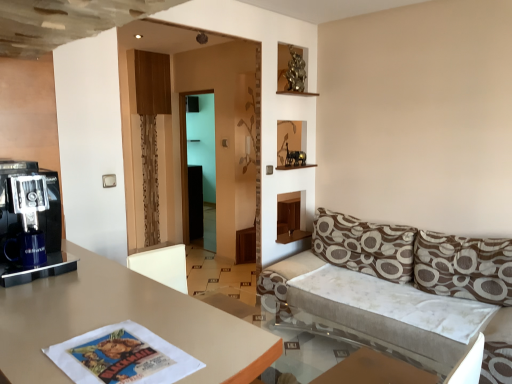
Question: Is brown textured pillow at right, the 1th pillow when ordered from right to left, facing away from matte beige table at center?

Choices:
 (A) yes
 (B) no

Answer: (B)

Question: From the image's perspective, is brown textured pillow at right, the 2th pillow in the left-to-right sequence, located beneath matte beige table at center?

Choices:
 (A) yes
 (B) no

Answer: (B)

Question: Does brown textured pillow at right, the 2th pillow in the left-to-right sequence, appear on the right side of matte beige table at center?

Choices:
 (A) yes
 (B) no

Answer: (A)

Question: From the image's perspective, does brown textured pillow at right, the 1th pillow when ordered from right to left, appear higher than matte beige table at center?

Choices:
 (A) yes
 (B) no

Answer: (A)

Question: Is brown textured pillow at right, the 1th pillow when ordered from right to left, further to the viewer compared to matte beige table at center?

Choices:
 (A) no
 (B) yes

Answer: (B)

Question: From the image's perspective, is brown printed cushion at right, arranged as the first pillow when viewed from the left, positioned above or below transparent glass table at lower right?

Choices:
 (A) below
 (B) above

Answer: (B)

Question: Is brown printed cushion at right, arranged as the first pillow when viewed from the left, bigger or smaller than transparent glass table at lower right?

Choices:
 (A) small
 (B) big

Answer: (A)

Question: From a real-world perspective, is brown printed cushion at right, arranged as the first pillow when viewed from the left, positioned above or below transparent glass table at lower right?

Choices:
 (A) below
 (B) above

Answer: (B)

Question: Is brown printed cushion at right, placed as the 2th pillow when sorted from right to left, in front of or behind transparent glass table at lower right in the image?

Choices:
 (A) behind
 (B) front

Answer: (A)

Question: Which is correct: brown printed cushion at right, placed as the 2th pillow when sorted from right to left, is inside brown textured pillow at right, the 1th pillow when ordered from right to left, or outside of it?

Choices:
 (A) inside
 (B) outside

Answer: (B)

Question: Does point (335, 264) appear closer or farther from the camera than point (490, 294)?

Choices:
 (A) farther
 (B) closer

Answer: (A)

Question: Is brown printed cushion at right, arranged as the first pillow when viewed from the left, wider or thinner than brown textured pillow at right, the 1th pillow when ordered from right to left?

Choices:
 (A) wide
 (B) thin

Answer: (B)

Question: In terms of height, does brown printed cushion at right, placed as the 2th pillow when sorted from right to left, look taller or shorter compared to brown textured pillow at right, the 1th pillow when ordered from right to left?

Choices:
 (A) short
 (B) tall

Answer: (A)

Question: Is point (113, 312) closer or farther from the camera than point (193, 127)?

Choices:
 (A) farther
 (B) closer

Answer: (B)

Question: Relative to transparent glass door at center, is matte beige table at center in front or behind?

Choices:
 (A) front
 (B) behind

Answer: (A)